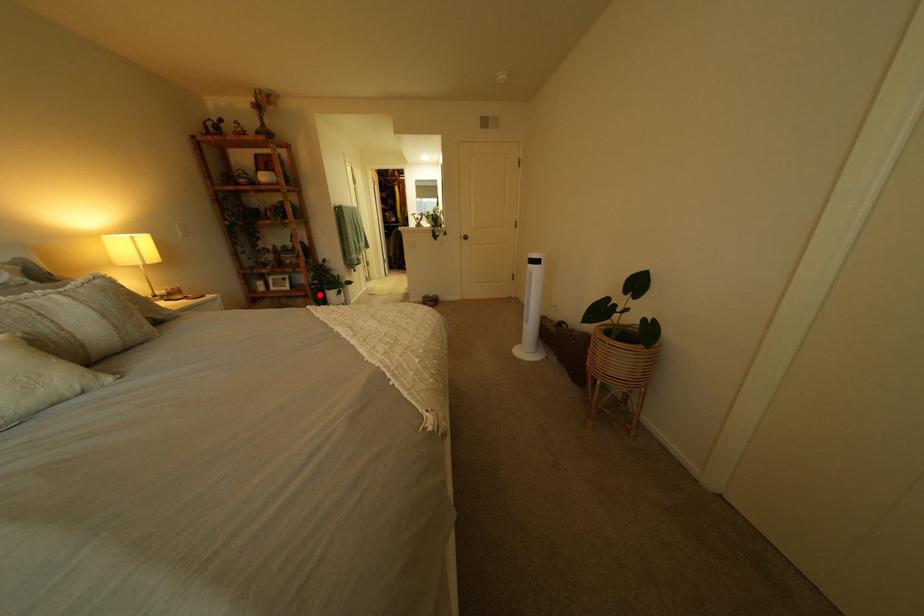
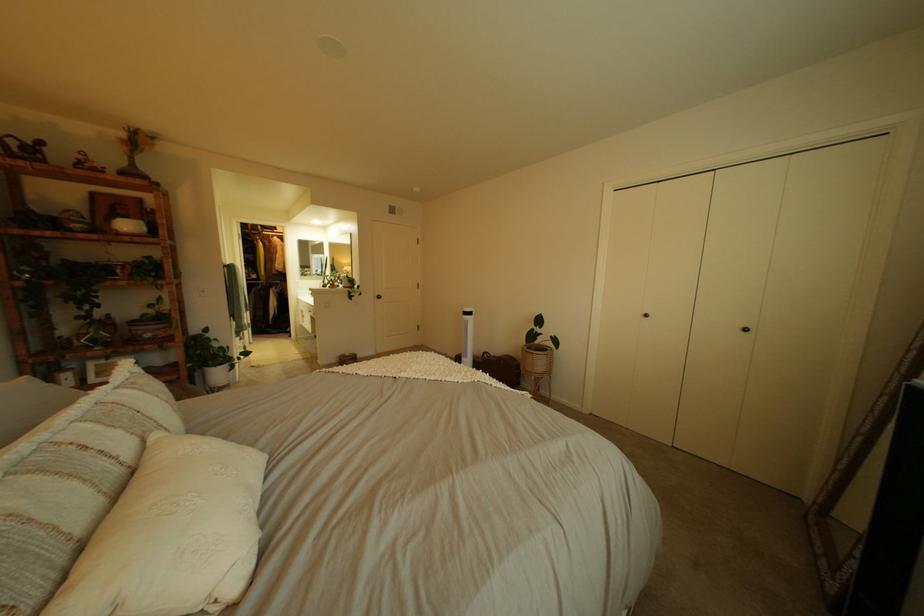
Find the pixel in the second image that matches the highlighted location in the first image.

(189, 379)